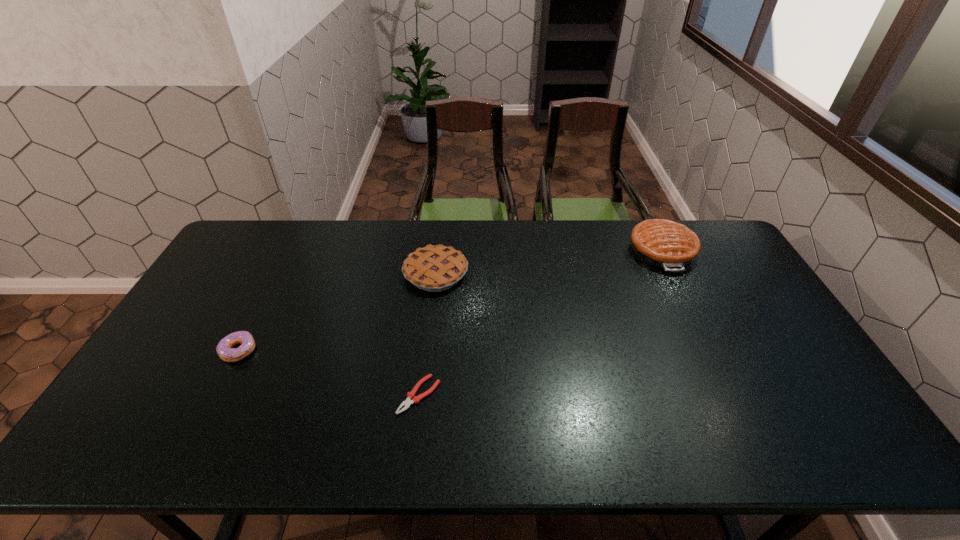
Where is `vacant area situated on the left of the second nearest object`? This screenshot has width=960, height=540. vacant area situated on the left of the second nearest object is located at coordinates (160, 350).

This screenshot has height=540, width=960. What are the coordinates of `free space located on the right of the pliers` in the screenshot? It's located at (470, 395).

Identify the location of object positioned at the right edge. The width and height of the screenshot is (960, 540). (662, 243).

This screenshot has height=540, width=960. Find the location of `object present at the far right corner`. object present at the far right corner is located at coordinates (662, 243).

In the image, there is a desktop. Where is `vacant space at the far edge`? This screenshot has width=960, height=540. vacant space at the far edge is located at coordinates (332, 235).

Locate an element on the screen. vacant space at the near edge of the desktop is located at coordinates (540, 447).

At what (x,y) coordinates should I click in order to perform the action: click on free point at the left edge. Please return your answer as a coordinate pair (x, y). The image size is (960, 540). Looking at the image, I should click on (196, 345).

In the image, there is a desktop. Where is `free region at the right edge`? This screenshot has height=540, width=960. free region at the right edge is located at coordinates (744, 322).

The image size is (960, 540). I want to click on vacant position at the far left corner of the desktop, so click(x=262, y=221).

Where is `free space between the tallest object and the nearest object`? free space between the tallest object and the nearest object is located at coordinates (540, 323).